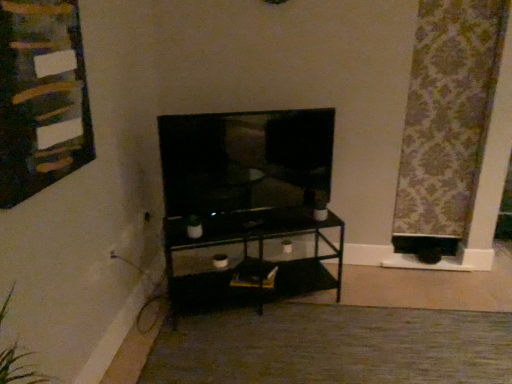
Describe the element at coordinates (41, 97) in the screenshot. I see `wooden bulletin board at upper left` at that location.

At what (x,y) coordinates should I click in order to perform the action: click on matte black tv at center. Please return your answer as a coordinate pair (x, y). The width and height of the screenshot is (512, 384). Looking at the image, I should click on (246, 161).

Between point (239, 137) and point (440, 25), which one is positioned in front?

The point (239, 137) is closer.

Consider the image. Is matte black tv at center next to patterned fabric curtain at right?

matte black tv at center and patterned fabric curtain at right are clearly separated.

Does matte black tv at center have a larger size compared to patterned fabric curtain at right?

Correct, matte black tv at center is larger in size than patterned fabric curtain at right.

From the image's perspective, is matte black tv at center above or below patterned fabric curtain at right?

matte black tv at center is situated lower than patterned fabric curtain at right in the image.

Between black glass shelf at center and wooden bulletin board at upper left, which one has smaller size?

wooden bulletin board at upper left.

From a real-world perspective, is black glass shelf at center physically below wooden bulletin board at upper left?

Correct, in the physical world, black glass shelf at center is lower than wooden bulletin board at upper left.

Looking at this image, considering the relative sizes of black glass shelf at center and wooden bulletin board at upper left in the image provided, is black glass shelf at center shorter than wooden bulletin board at upper left?

Yes, black glass shelf at center is shorter than wooden bulletin board at upper left.

From the image's perspective, between black glass shelf at center and wooden bulletin board at upper left, which one is located above?

From the image's view, wooden bulletin board at upper left is above.

How far apart are wooden bulletin board at upper left and matte black tv at center?

wooden bulletin board at upper left is 33.21 inches from matte black tv at center.

From the image's perspective, which object appears higher, wooden bulletin board at upper left or matte black tv at center?

From the image's view, wooden bulletin board at upper left is above.

Can you tell me how much wooden bulletin board at upper left and matte black tv at center differ in facing direction?

70 degrees.

Is point (75, 140) behind point (184, 174)?

That is False.

Which of these two, black glass shelf at center or patterned fabric curtain at right, is thinner?

With smaller width is patterned fabric curtain at right.

Looking at this image, is black glass shelf at center touching patterned fabric curtain at right?

black glass shelf at center and patterned fabric curtain at right are clearly separated.

Which is more distant, [246,264] or [470,168]?

The point [470,168] is farther from the camera.

Which point is more distant from viewer, (325, 189) or (320, 223)?

Point (325, 189)

From the image's perspective, which object appears higher, matte black tv at center or black glass shelf at center?

matte black tv at center appears higher in the image.

At what (x,y) coordinates should I click in order to perform the action: click on shelf on the right of matte black tv at center. Please return your answer as a coordinate pair (x, y). The width and height of the screenshot is (512, 384). Looking at the image, I should click on (251, 259).

From a real-world perspective, is carpet at center positioned over wooden bulletin board at upper left based on gravity?

Incorrect, from a real-world perspective, carpet at center is lower than wooden bulletin board at upper left.

Is carpet at center positioned far away from wooden bulletin board at upper left?

Absolutely, carpet at center is distant from wooden bulletin board at upper left.

You are a GUI agent. You are given a task and a screenshot of the screen. Output one action in this format:
    pyautogui.click(x=<x>, y=<y>)
    Task: Click on the plain below the wooden bulletin board at upper left (from the image's perspective)
    The width and height of the screenshot is (512, 384).
    Given the screenshot: What is the action you would take?
    pyautogui.click(x=334, y=347)

Which object is more forward, carpet at center or wooden bulletin board at upper left?

wooden bulletin board at upper left is closer to the camera.

Is there a large distance between patterned fabric curtain at right and black glass shelf at center?

Yes, patterned fabric curtain at right is far from black glass shelf at center.

From a real-world perspective, relative to black glass shelf at center, is patterned fabric curtain at right vertically above or below?

In terms of real-world spatial position, patterned fabric curtain at right is above black glass shelf at center.

Is point (506, 6) less distant than point (275, 261)?

Yes, point (506, 6) is in front of point (275, 261).

Is patterned fabric curtain at right positioned beyond the bounds of black glass shelf at center?

Yes, patterned fabric curtain at right is located beyond the bounds of black glass shelf at center.

In order to click on curtain behind the matte black tv at center in this screenshot , I will do `click(447, 120)`.

Find the location of a particular element. The width and height of the screenshot is (512, 384). shelf that is under the wooden bulletin board at upper left (from a real-world perspective) is located at coordinates tap(251, 259).

When comparing their distances from black glass shelf at center, does carpet at center or patterned fabric curtain at right seem further?

The object further to black glass shelf at center is patterned fabric curtain at right.

Estimate the real-world distances between objects in this image. Which object is closer to carpet at center, matte black tv at center or wooden bulletin board at upper left?

matte black tv at center lies closer to carpet at center than the other object.

When comparing their distances from black glass shelf at center, does matte black tv at center or patterned fabric curtain at right seem closer?

matte black tv at center lies closer to black glass shelf at center than the other object.

From the image, which object appears to be farther from black glass shelf at center, wooden bulletin board at upper left or matte black tv at center?

wooden bulletin board at upper left is positioned further to the anchor black glass shelf at center.

From the image, which object appears to be farther from matte black tv at center, carpet at center or black glass shelf at center?

carpet at center is further to matte black tv at center.

When comparing their distances from carpet at center, does black glass shelf at center or matte black tv at center seem closer?

black glass shelf at center lies closer to carpet at center than the other object.

Based on the photo, considering their positions, is matte black tv at center positioned closer to patterned fabric curtain at right than black glass shelf at center?

Based on the image, matte black tv at center appears to be nearer to patterned fabric curtain at right.

Estimate the real-world distances between objects in this image. Which object is further from matte black tv at center, wooden bulletin board at upper left or patterned fabric curtain at right?

The object further to matte black tv at center is patterned fabric curtain at right.

Where is `shelf between matte black tv at center and patterned fabric curtain at right in the horizontal direction`? The width and height of the screenshot is (512, 384). shelf between matte black tv at center and patterned fabric curtain at right in the horizontal direction is located at coordinates [x=251, y=259].

Locate an element on the screen. television located between wooden bulletin board at upper left and black glass shelf at center in the depth direction is located at coordinates (246, 161).

The image size is (512, 384). What are the coordinates of `television between wooden bulletin board at upper left and carpet at center vertically` in the screenshot? It's located at (246, 161).

Locate an element on the screen. Image resolution: width=512 pixels, height=384 pixels. plain between wooden bulletin board at upper left and patterned fabric curtain at right is located at coordinates pyautogui.click(x=334, y=347).